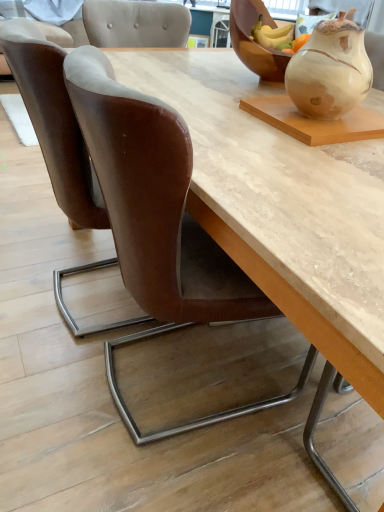
Question: Is matte ceramic vase at upper right facing away from brown leather chair at lower left, placed as the 1th chair when sorted from left to right?

Choices:
 (A) yes
 (B) no

Answer: (B)

Question: Considering the relative sizes of matte ceramic vase at upper right and brown leather chair at lower left, placed as the 1th chair when sorted from left to right, in the image provided, is matte ceramic vase at upper right shorter than brown leather chair at lower left, placed as the 1th chair when sorted from left to right,?

Choices:
 (A) no
 (B) yes

Answer: (B)

Question: From the image's perspective, is matte ceramic vase at upper right below brown leather chair at lower left, placed as the 1th chair when sorted from left to right?

Choices:
 (A) no
 (B) yes

Answer: (A)

Question: From a real-world perspective, is matte ceramic vase at upper right over brown leather chair at lower left, marked as the second chair in a right-to-left arrangement?

Choices:
 (A) yes
 (B) no

Answer: (A)

Question: Is matte ceramic vase at upper right thinner than brown leather chair at lower left, marked as the second chair in a right-to-left arrangement?

Choices:
 (A) yes
 (B) no

Answer: (A)

Question: Can you confirm if matte ceramic vase at upper right is positioned to the left of brown leather chair at lower left, marked as the second chair in a right-to-left arrangement?

Choices:
 (A) no
 (B) yes

Answer: (A)

Question: From a real-world perspective, is matte ceramic vase at upper right physically below wooden bowl at upper right?

Choices:
 (A) no
 (B) yes

Answer: (A)

Question: Is matte ceramic vase at upper right looking in the opposite direction of wooden bowl at upper right?

Choices:
 (A) no
 (B) yes

Answer: (A)

Question: Does matte ceramic vase at upper right have a lesser height compared to wooden bowl at upper right?

Choices:
 (A) yes
 (B) no

Answer: (A)

Question: Does matte ceramic vase at upper right appear on the left side of wooden bowl at upper right?

Choices:
 (A) no
 (B) yes

Answer: (A)

Question: Does matte ceramic vase at upper right have a greater height compared to wooden bowl at upper right?

Choices:
 (A) no
 (B) yes

Answer: (A)

Question: Is the position of matte ceramic vase at upper right less distant than that of wooden bowl at upper right?

Choices:
 (A) yes
 (B) no

Answer: (A)

Question: Is brown leather chair at left, marked as the first chair in a right-to-left arrangement, positioned with its back to brown leather chair at lower left, marked as the second chair in a right-to-left arrangement?

Choices:
 (A) yes
 (B) no

Answer: (B)